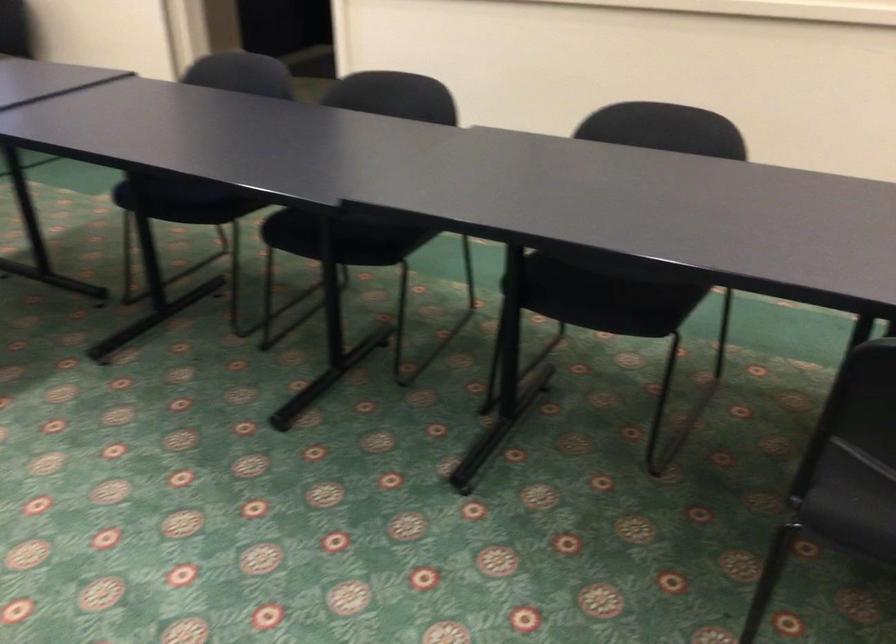
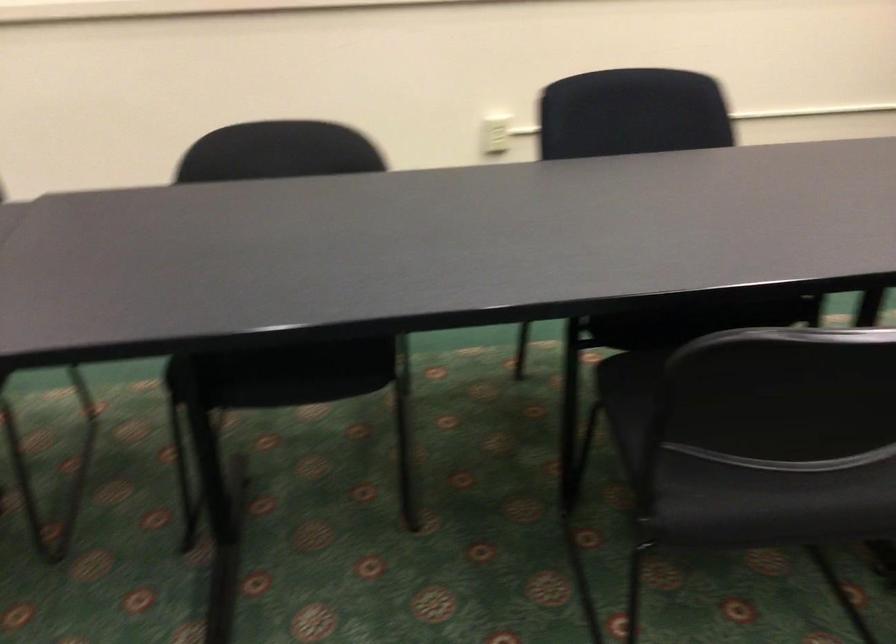
In the second image, find the point that corresponds to point 591,292 in the first image.

(291, 363)